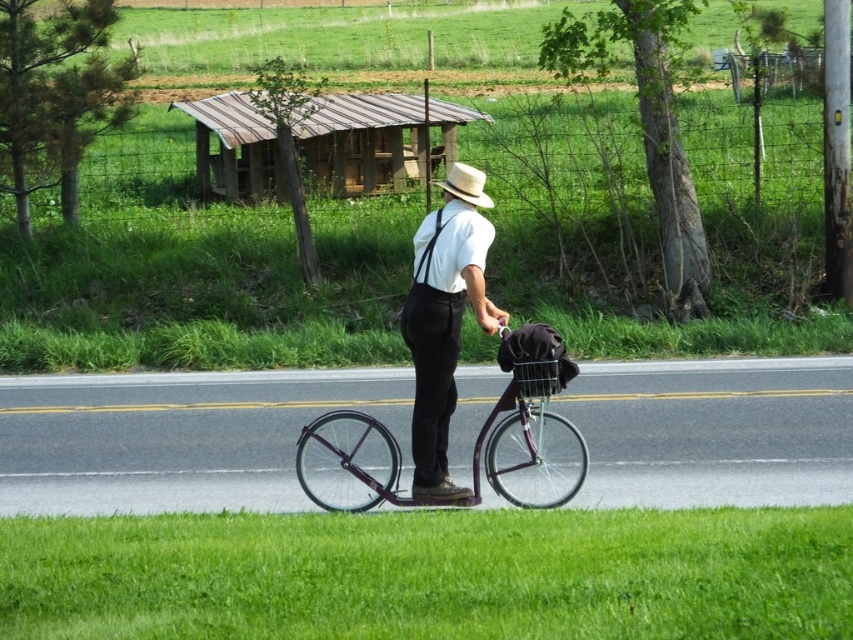
Question: Which object is closer to the camera taking this photo?

Choices:
 (A) white matte shirt at center
 (B) straw hat at center
 (C) metal/wooden hut at upper center
 (D) purple matte bicycle at center

Answer: (A)

Question: Is purple matte bicycle at center behind metallic wire basket at center?

Choices:
 (A) yes
 (B) no

Answer: (A)

Question: Which object is the closest to the black fabric suspenders at center?

Choices:
 (A) white matte shirt at center
 (B) straw hat at center

Answer: (A)

Question: Which object is positioned farthest from the straw hat at center?

Choices:
 (A) metallic wire basket at center
 (B) metal/wooden hut at upper center
 (C) black fabric suspenders at center
 (D) white matte shirt at center

Answer: (C)

Question: Considering the relative positions of metal/wooden hut at upper center and purple matte bicycle at center in the image provided, where is metal/wooden hut at upper center located with respect to purple matte bicycle at center?

Choices:
 (A) above
 (B) below

Answer: (A)

Question: Is metal/wooden hut at upper center thinner than straw hat at center?

Choices:
 (A) yes
 (B) no

Answer: (B)